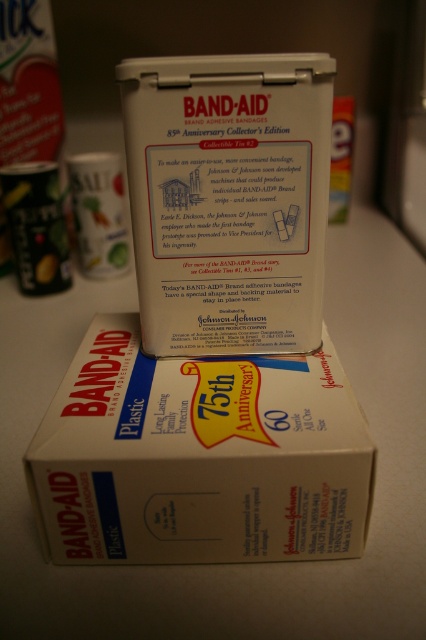
Is white plastic box at center to the left of white matte tin at upper center from the viewer's perspective?

Indeed, white plastic box at center is positioned on the left side of white matte tin at upper center.

Who is positioned more to the right, white plastic box at center or white matte tin at upper center?

white matte tin at upper center

Image resolution: width=426 pixels, height=640 pixels. What are the coordinates of `white plastic box at center` in the screenshot? It's located at (198, 456).